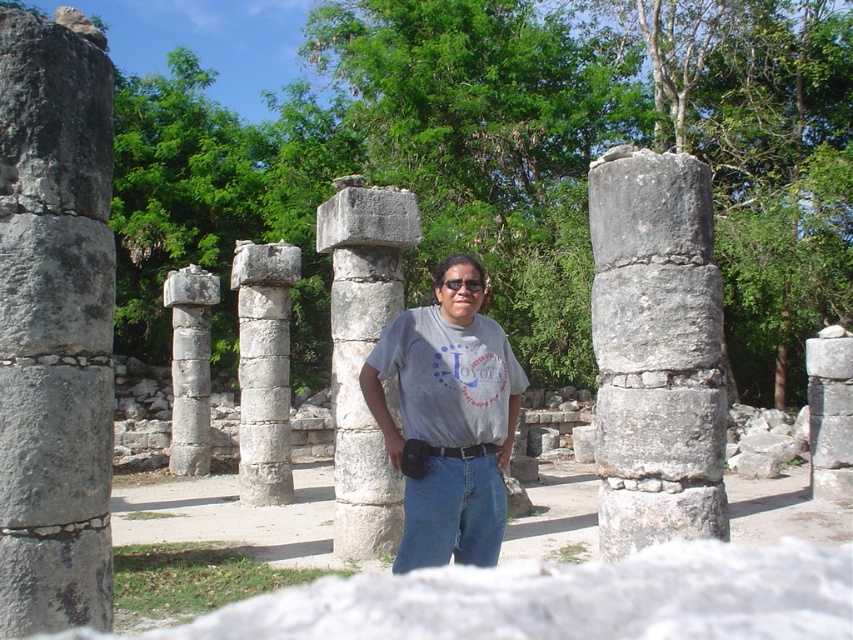
You are an archaeologist examining the ancient stone columns. You need to determine which column is bigger between the white stone column at center and the smooth stone column at right. Based on the scene, which one is larger?

The white stone column at center is larger in size than the smooth stone column at right.

You are a photographer trying to capture the gray stone column at right and the black matte sunglasses at center in a single frame. Considering their sizes, which object should you focus on first to ensure both fit well in the photo?

The gray stone column at right is larger than the black matte sunglasses at center, so you should focus on the gray stone column at right first to ensure it fits within the frame, allowing space for the smaller sunglasses.

You are a photographer planning to take a photo of the gray stone column at right and the black matte sunglasses at center. Based on the scene description, which object should appear larger in the photo?

The gray stone column at right should appear larger in the photo because it is much taller than the black matte sunglasses at center.